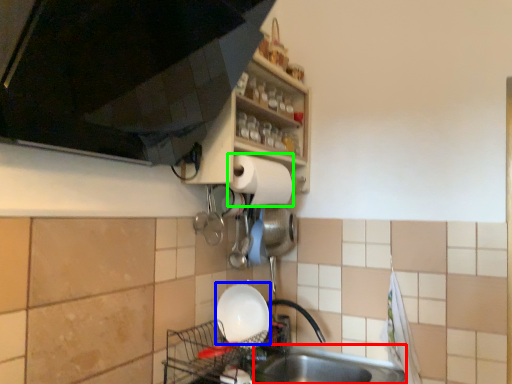
Question: Based on their relative distances, which object is farther from sink (highlighted by a red box)? Choose from basin (highlighted by a blue box) and paper towel (highlighted by a green box).

Choices:
 (A) basin
 (B) paper towel

Answer: (B)